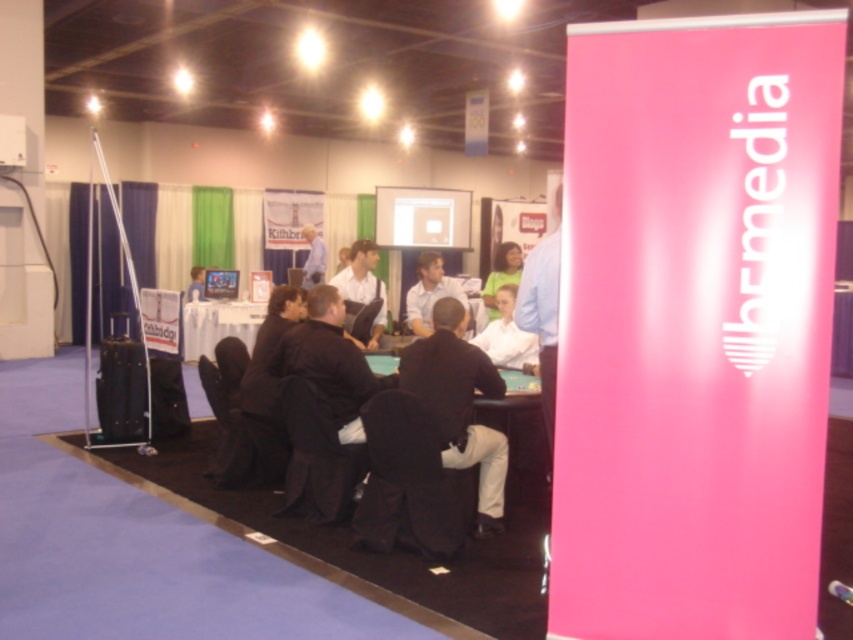
Question: Can you confirm if smooth black table at center is positioned below matte black shirt at center?

Choices:
 (A) yes
 (B) no

Answer: (A)

Question: Among these objects, which one is nearest to the camera?

Choices:
 (A) smooth black table at center
 (B) light blue shirt at center
 (C) dark gray suit at center
 (D) wooden table at center

Answer: (C)

Question: Which of the following is the closest to the observer?

Choices:
 (A) (425, 280)
 (B) (209, 304)
 (C) (453, 371)
 (D) (325, 250)

Answer: (C)

Question: Which point is closer to the camera taking this photo?

Choices:
 (A) (517, 444)
 (B) (253, 332)
 (C) (325, 264)
 (D) (419, 332)

Answer: (A)

Question: Is dark gray suit at center closer to camera compared to wooden table at center?

Choices:
 (A) yes
 (B) no

Answer: (A)

Question: Can you confirm if dark gray suit at center is smaller than light blue shirt at center?

Choices:
 (A) no
 (B) yes

Answer: (A)